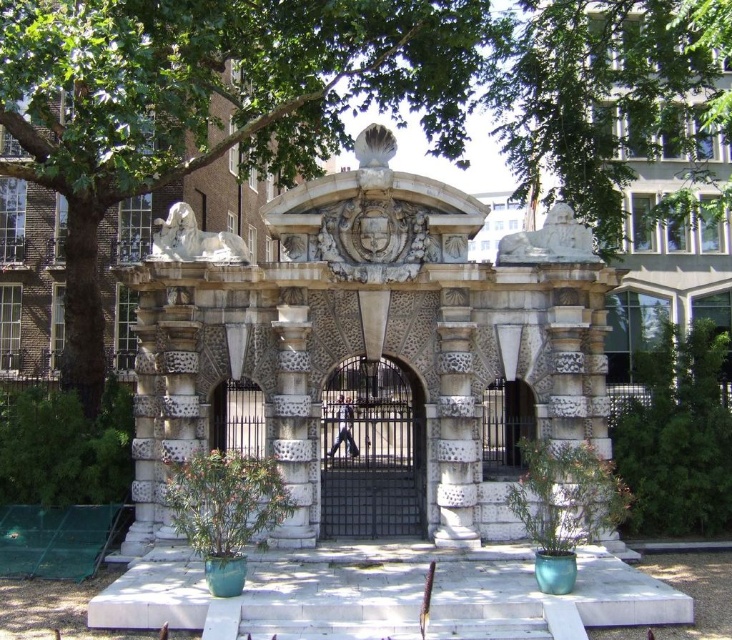
Question: Which of the following is the closest to the observer?

Choices:
 (A) (496, 456)
 (B) (72, 77)

Answer: (B)

Question: Can you confirm if black metal gate at center is positioned below dark gray metal gate at center?

Choices:
 (A) no
 (B) yes

Answer: (A)

Question: Is white stone gate at center to the right of polished metal gate at center from the viewer's perspective?

Choices:
 (A) yes
 (B) no

Answer: (B)

Question: Which of the following is the farthest from the observer?

Choices:
 (A) (485, 474)
 (B) (310, 374)

Answer: (A)

Question: Does black metal gate at center appear over polished metal gate at center?

Choices:
 (A) no
 (B) yes

Answer: (B)

Question: Estimate the real-world distances between objects in this image. Which object is closer to the black metal gate at center?

Choices:
 (A) green leafy tree at center
 (B) white stone gate at center

Answer: (B)